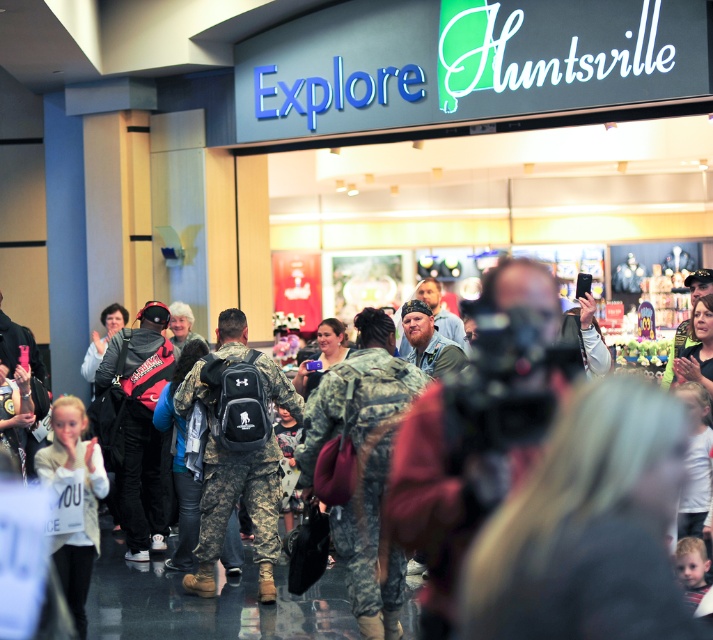
You are standing at the entrance of the mall and see the camouflage backpack at center. If you walk straight ahead, will you reach the backpack before reaching the Explore Huntsville storefront in the background?

The camouflage backpack at center is located at point (237, 449), which is closer to the entrance than the Explore Huntsville storefront in the background. Therefore, you will reach the camouflage backpack at center before the storefront.

You are standing in the shopping mall and see the camouflage backpack at center and the white cotton shirt at lower left. Which object is positioned to the right of the other?

The camouflage backpack at center is to the right of the white cotton shirt at lower left.

You are standing at point (83, 412) and want to walk to point (257, 436). Is the destination point behind you or in front of you?

The destination point (257, 436) is behind point (83, 412), so it is behind you.